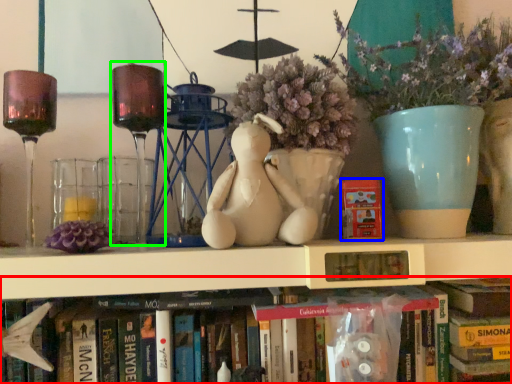
Question: Which object is the closest to the book (highlighted by a red box)? Choose among these: paperback book (highlighted by a blue box) or candle holder (highlighted by a green box).

Choices:
 (A) paperback book
 (B) candle holder

Answer: (A)